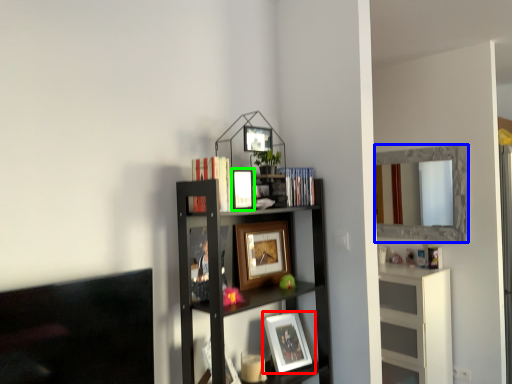
Question: Which object is the closest to the picture frame (highlighted by a red box)? Choose among these: mirror (highlighted by a blue box) or picture frame (highlighted by a green box).

Choices:
 (A) mirror
 (B) picture frame

Answer: (B)